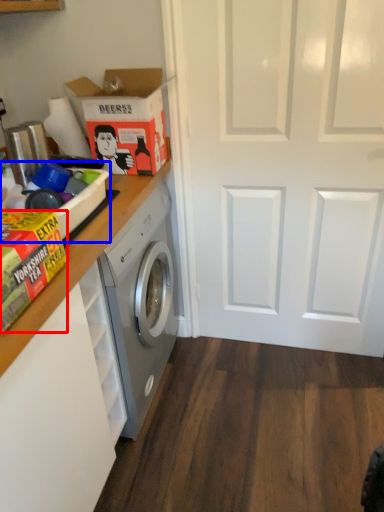
Question: Which object is closer to the camera taking this photo, cardboard box (highlighted by a red box) or box (highlighted by a blue box)?

Choices:
 (A) cardboard box
 (B) box

Answer: (A)